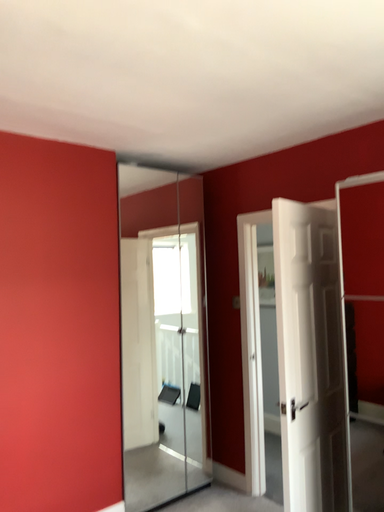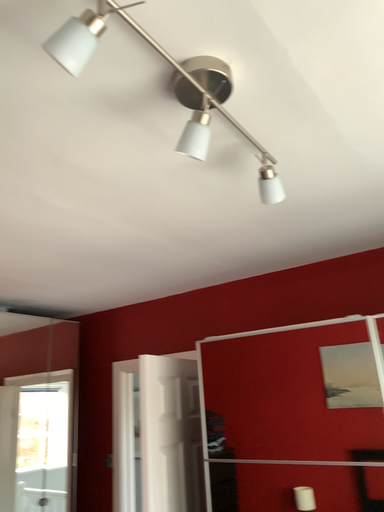
Question: Which way did the camera rotate in the video?

Choices:
 (A) rotated upward
 (B) rotated downward

Answer: (A)